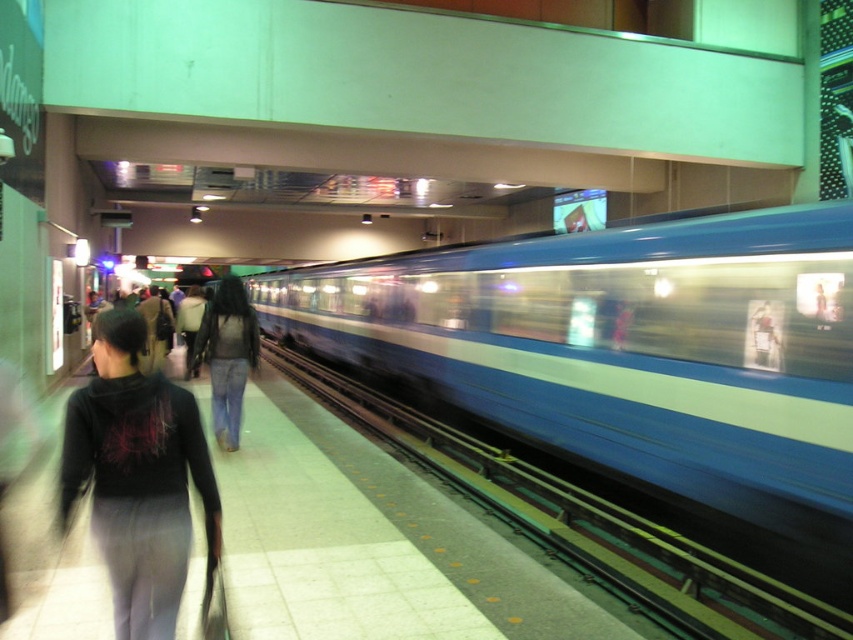
Question: Which of the following is the farthest from the observer?

Choices:
 (A) click(x=177, y=320)
 (B) click(x=253, y=336)

Answer: (A)

Question: Among these objects, which one is farthest from the camera?

Choices:
 (A) dark gray sweatpants at lower left
 (B) denim jeans at center

Answer: (B)

Question: Considering the real-world distances, which object is farthest from the denim jeans at center?

Choices:
 (A) dark gray sweatpants at lower left
 (B) dark blue jeans at center
 (C) dark gray jacket at center

Answer: (C)

Question: In this image, where is dark gray sweatpants at lower left located relative to dark blue jeans at center?

Choices:
 (A) below
 (B) above

Answer: (A)

Question: Is the position of dark gray sweatpants at lower left less distant than that of dark gray jacket at center?

Choices:
 (A) no
 (B) yes

Answer: (B)

Question: Does denim jeans at center have a larger size compared to dark blue jeans at center?

Choices:
 (A) no
 (B) yes

Answer: (A)